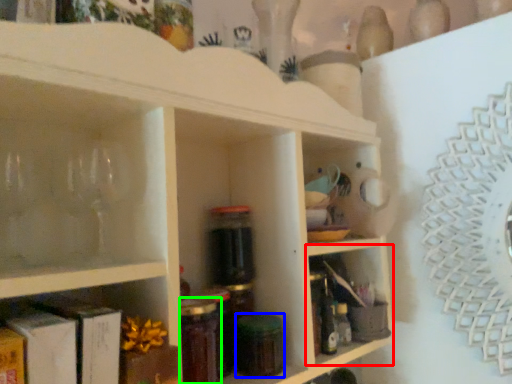
Question: Which object is positioned farthest from shelf (highlighted by a red box)? Select from glass jar (highlighted by a blue box) and bottle (highlighted by a green box).

Choices:
 (A) glass jar
 (B) bottle

Answer: (B)